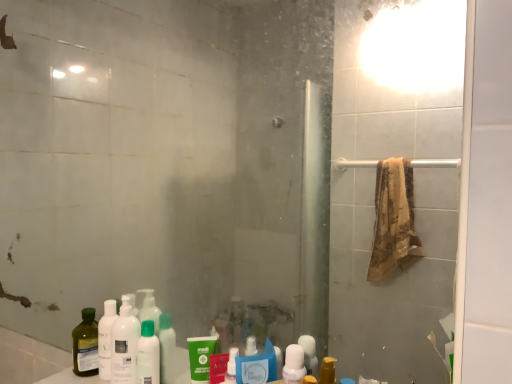
Question: Which direction should I rotate to look at green matte tube at lower center, which is the 2th mouthwash in right-to-left order, — up or down?

Choices:
 (A) down
 (B) up

Answer: (A)

Question: Is green matte bottle at center further to camera compared to green matte tube at lower center, which is the 2th mouthwash in right-to-left order?

Choices:
 (A) no
 (B) yes

Answer: (B)

Question: Considering the relative sizes of green matte bottle at center and green matte tube at lower center, which is the 2th mouthwash in right-to-left order, in the image provided, is green matte bottle at center bigger than green matte tube at lower center, which is the 2th mouthwash in right-to-left order,?

Choices:
 (A) yes
 (B) no

Answer: (B)

Question: Is green matte bottle at center not close to green matte tube at lower center, which is the 2th mouthwash in right-to-left order?

Choices:
 (A) no
 (B) yes

Answer: (A)

Question: Can green matte tube at lower center, the first mouthwash from the left, be found inside green matte bottle at center?

Choices:
 (A) no
 (B) yes

Answer: (A)

Question: Is green matte bottle at center smaller than green matte tube at lower center, which is the 2th mouthwash in right-to-left order?

Choices:
 (A) no
 (B) yes

Answer: (B)

Question: From the image's perspective, is green matte bottle at center below green matte tube at lower center, the first mouthwash from the back?

Choices:
 (A) yes
 (B) no

Answer: (B)

Question: Can you confirm if green matte bottle at center is shorter than white plastic bottle at lower center, the 1th mouthwash from the front?

Choices:
 (A) yes
 (B) no

Answer: (A)

Question: From a real-world perspective, is green matte bottle at center physically above white plastic bottle at lower center, marked as the second mouthwash in a back-to-front arrangement?

Choices:
 (A) yes
 (B) no

Answer: (B)

Question: From the image's perspective, would you say green matte bottle at center is positioned over white plastic bottle at lower center, marked as the 1th mouthwash in a right-to-left arrangement?

Choices:
 (A) yes
 (B) no

Answer: (A)

Question: Considering the relative positions of green matte bottle at center and white plastic bottle at lower center, marked as the 1th mouthwash in a right-to-left arrangement, in the image provided, is green matte bottle at center to the left of white plastic bottle at lower center, marked as the 1th mouthwash in a right-to-left arrangement, from the viewer's perspective?

Choices:
 (A) no
 (B) yes

Answer: (B)

Question: Is green matte bottle at center closer to the viewer compared to white plastic bottle at lower center, the 1th mouthwash from the front?

Choices:
 (A) no
 (B) yes

Answer: (A)

Question: Is green matte bottle at center wider than white plastic bottle at lower center, marked as the 1th mouthwash in a right-to-left arrangement?

Choices:
 (A) yes
 (B) no

Answer: (A)

Question: Considering the relative sizes of white matte bottle at lower left and white plastic bottle at lower center, the 1th mouthwash from the front, in the image provided, is white matte bottle at lower left taller than white plastic bottle at lower center, the 1th mouthwash from the front,?

Choices:
 (A) no
 (B) yes

Answer: (B)